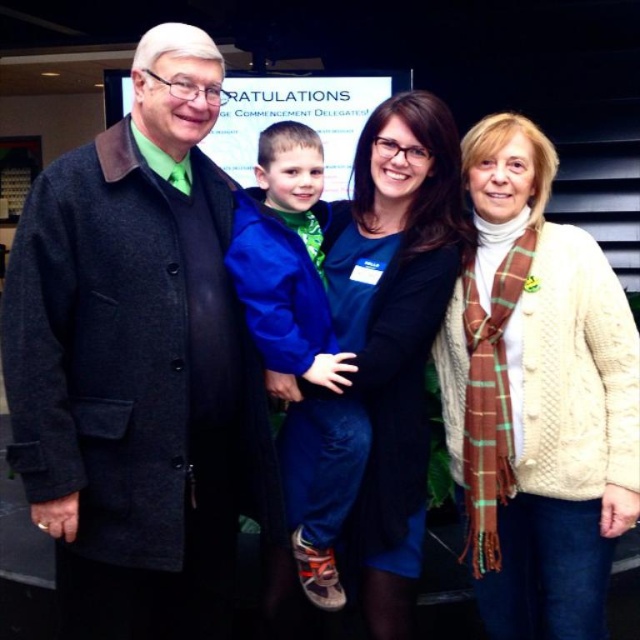
Which is below, white cable-knit sweater at center or blue fleece jacket at center?

white cable-knit sweater at center is below.

Who is positioned more to the right, white cable-knit sweater at center or blue fleece jacket at center?

Positioned to the right is white cable-knit sweater at center.

Is point (493, 616) less distant than point (304, 538)?

No, it is not.

Where is `white cable-knit sweater at center`? white cable-knit sweater at center is located at coordinates (536, 396).

In the scene shown: Does white cable-knit sweater at center appear on the left side of cable knit sweater at center?

No, white cable-knit sweater at center is not to the left of cable knit sweater at center.

Is white cable-knit sweater at center below cable knit sweater at center?

Indeed, white cable-knit sweater at center is positioned under cable knit sweater at center.

Where is `white cable-knit sweater at center`? The height and width of the screenshot is (640, 640). white cable-knit sweater at center is located at coordinates (536, 396).

Is matte black coat at left further to camera compared to white cable-knit sweater at center?

No, matte black coat at left is in front of white cable-knit sweater at center.

Who is positioned more to the left, matte black coat at left or white cable-knit sweater at center?

matte black coat at left

Locate an element on the screen. The width and height of the screenshot is (640, 640). matte black coat at left is located at coordinates (138, 364).

Locate an element on the screen. The height and width of the screenshot is (640, 640). matte black coat at left is located at coordinates (138, 364).